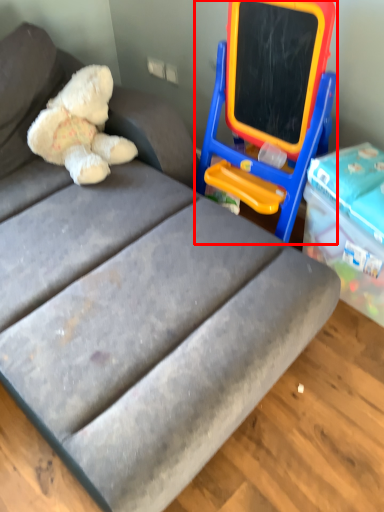
Question: From the image's perspective, where is equipment (annotated by the red box) located in relation to teddy bear in the image?

Choices:
 (A) below
 (B) above

Answer: (A)